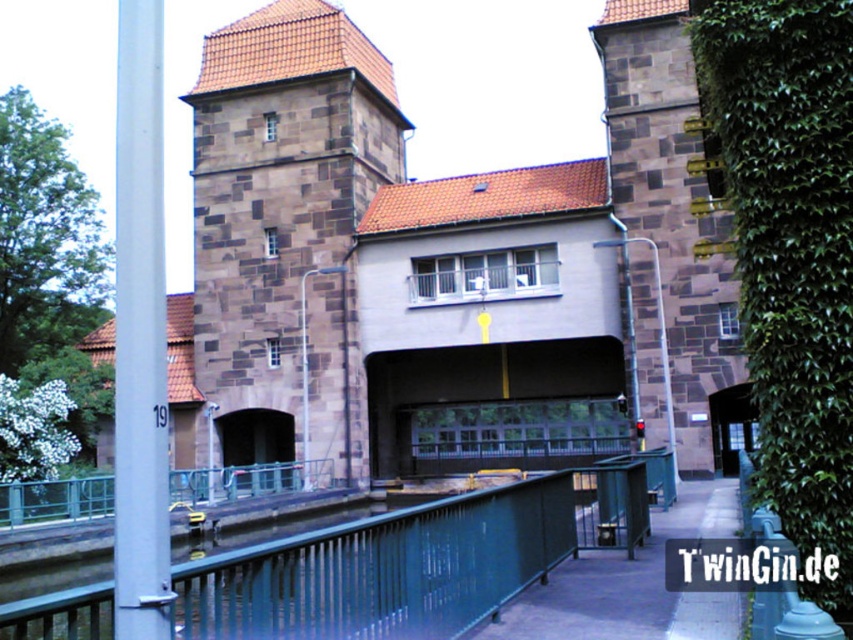
Is green leafy ivy at right below brown stone bell tower at right?

Yes, green leafy ivy at right is below brown stone bell tower at right.

Between green leafy ivy at right and brown stone bell tower at right, which one appears on the right side from the viewer's perspective?

Positioned to the right is brown stone bell tower at right.

The image size is (853, 640). What do you see at coordinates (788, 252) in the screenshot?
I see `green leafy ivy at right` at bounding box center [788, 252].

Where is `green leafy ivy at right`? green leafy ivy at right is located at coordinates (788, 252).

Does green metallic railing at center come behind brown stone bell tower at right?

No, green metallic railing at center is closer to the viewer.

Between green metallic railing at center and brown stone bell tower at right, which one is positioned higher?

brown stone bell tower at right is higher up.

At what (x,y) coordinates should I click in order to perform the action: click on green metallic railing at center. Please return your answer as a coordinate pair (x, y). Looking at the image, I should click on (412, 561).

Find the location of `green metallic railing at center`. green metallic railing at center is located at coordinates (412, 561).

Is brown stone bell tower at center shorter than brown stone bell tower at right?

No.

Can you confirm if brown stone bell tower at center is smaller than brown stone bell tower at right?

No.

Is point (323, 116) positioned behind point (630, 170)?

Yes.

Find the location of a particular element. Image resolution: width=853 pixels, height=640 pixels. brown stone bell tower at center is located at coordinates (283, 234).